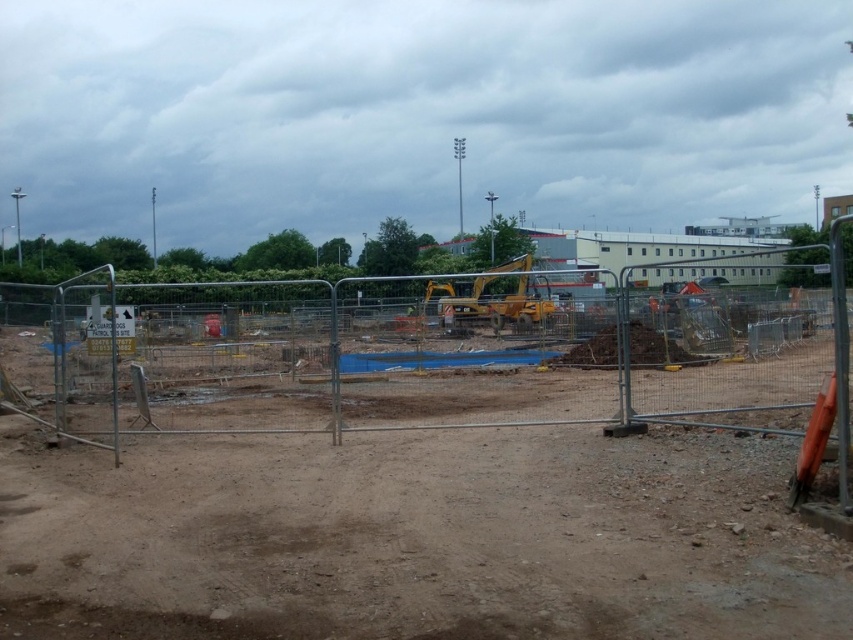
Question: Can you confirm if brown dirt at center is positioned above metal fence at center?

Choices:
 (A) no
 (B) yes

Answer: (A)

Question: Among these objects, which one is nearest to the camera?

Choices:
 (A) metal fence at center
 (B) yellow metallic excavator at center
 (C) brown dirt at center

Answer: (A)

Question: Estimate the real-world distances between objects in this image. Which object is farther from the yellow metallic excavator at center?

Choices:
 (A) metal fence at center
 (B) brown dirt at center

Answer: (B)

Question: Is metal fence at center closer to the viewer compared to yellow metallic excavator at center?

Choices:
 (A) no
 (B) yes

Answer: (B)

Question: Does metal fence at center have a lesser width compared to yellow metallic excavator at center?

Choices:
 (A) yes
 (B) no

Answer: (B)

Question: Which of the following is the farthest from the observer?

Choices:
 (A) brown dirt at center
 (B) yellow metallic excavator at center

Answer: (B)